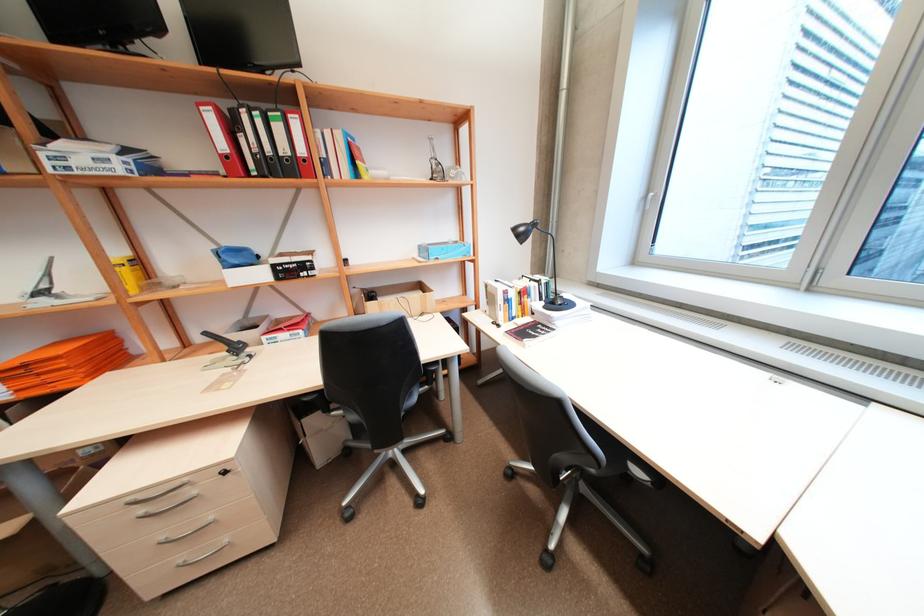
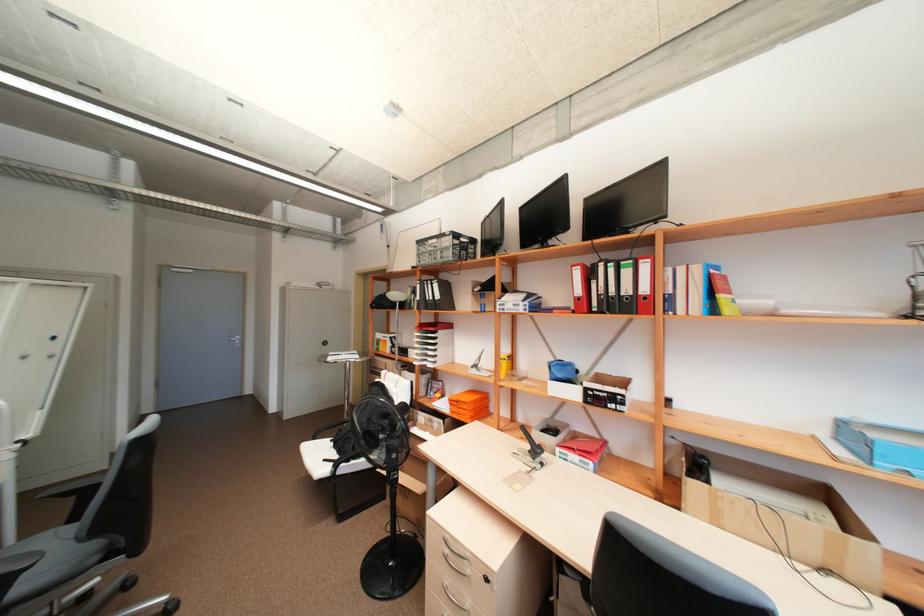
The point at (30, 367) is marked in the first image. Where is the corresponding point in the second image?

(463, 400)